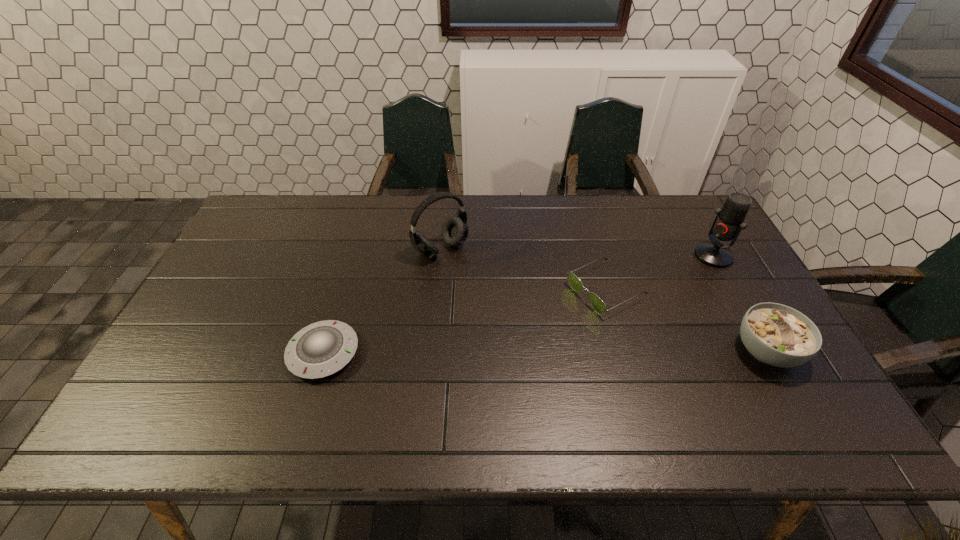
Locate an element on the screen. The image size is (960, 540). free spot on the desktop that is between the shortest object and the soup bowl and is positioned on the front-facing side of the third object from left to right is located at coordinates (479, 352).

I want to click on free space on the desktop that is between the leftmost object and the third shortest object and is positioned on the side of the microphone with the red ring, so click(544, 352).

In order to click on vacant space on the desktop that is between the saucer and the third tallest object and is positioned on the ear cups of the headset in this screenshot , I will do `click(543, 352)`.